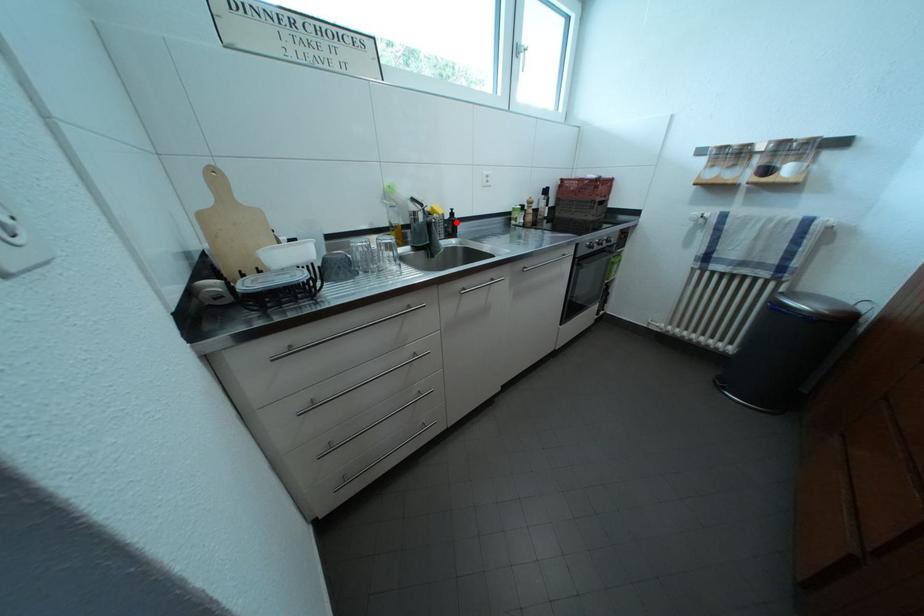
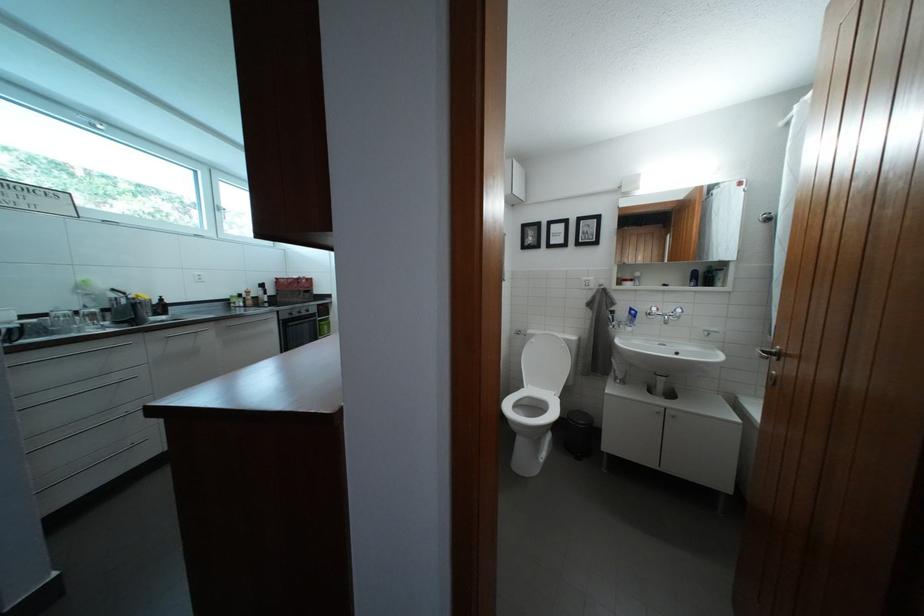
Find the pixel in the second image that matches the highlighted location in the first image.

(165, 307)